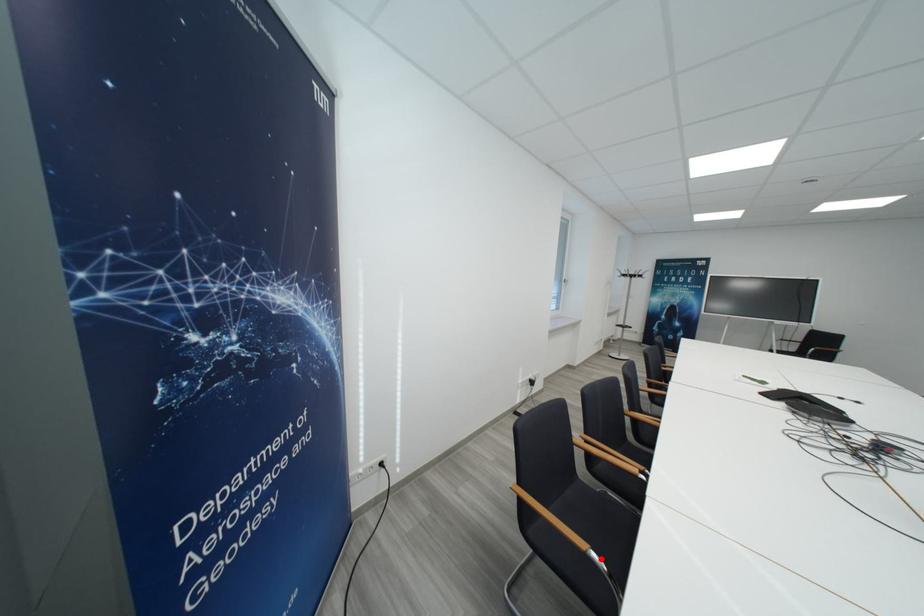
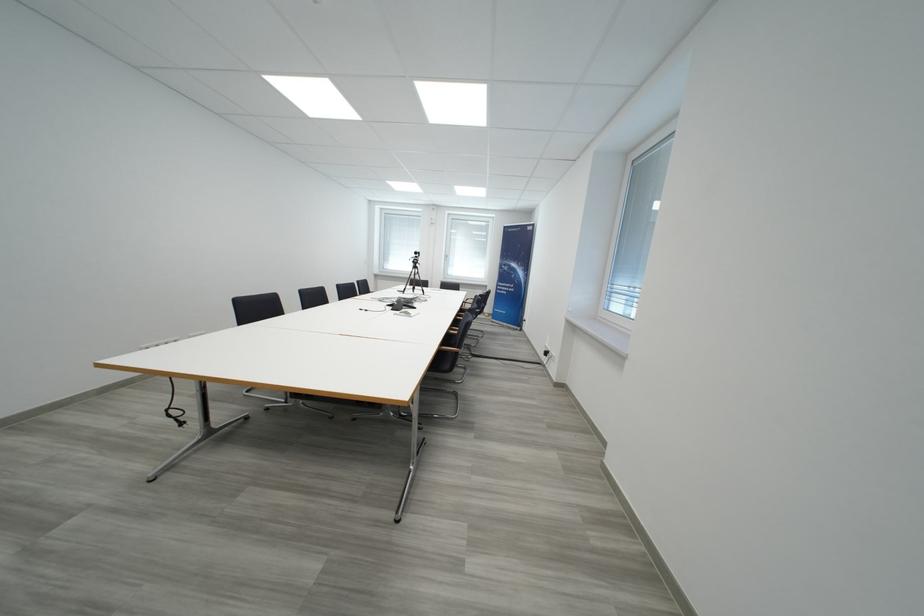
Question: I am providing you with two images of the same scene from different viewpoints. A red point is marked on the first image. Can you still see the location of the red point in image 2?

Choices:
 (A) Yes
 (B) No

Answer: (B)